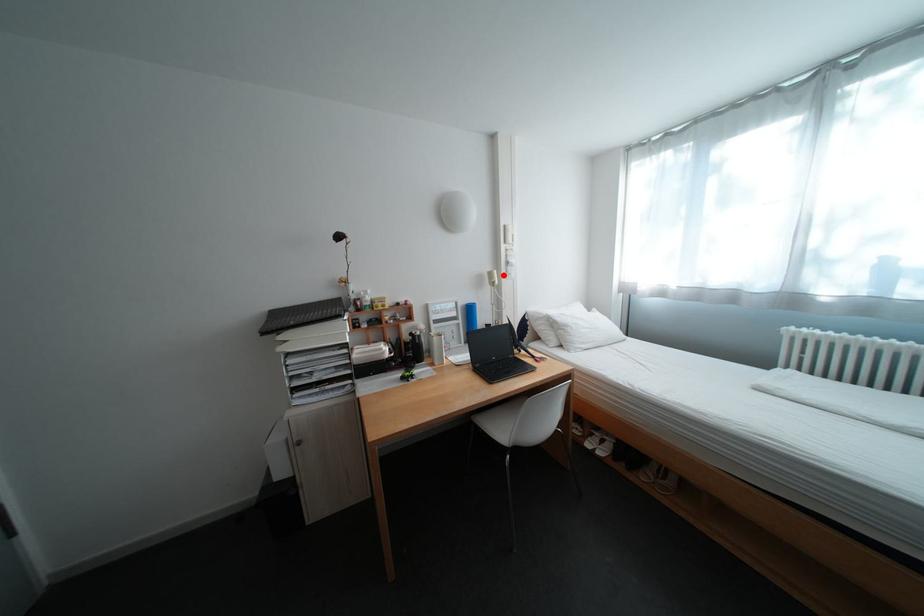
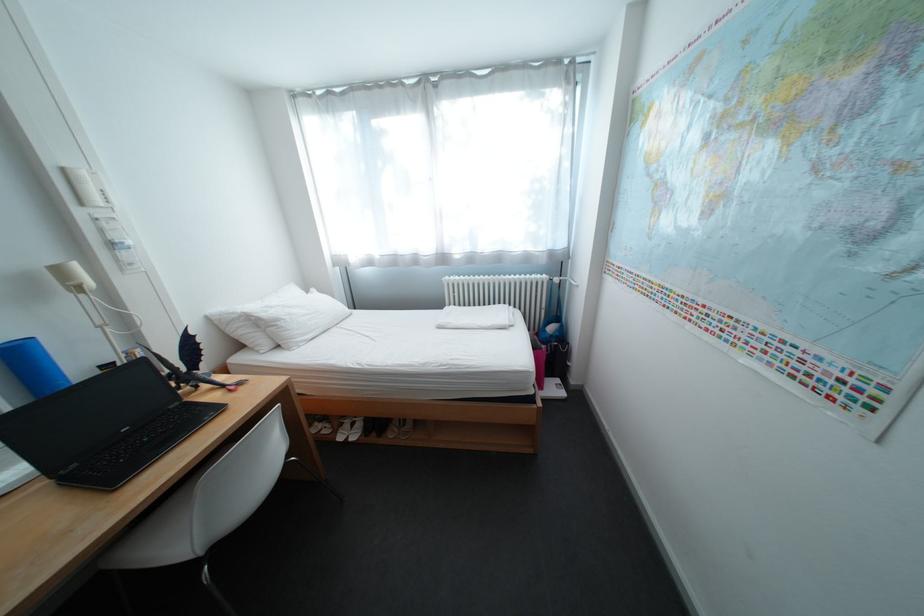
Question: I am providing you with two images of the same scene from different viewpoints. A red point is shown in image1. For the corresponding object point in image2, is it positioned nearer or farther from the camera?

Choices:
 (A) Nearer
 (B) Farther

Answer: (B)